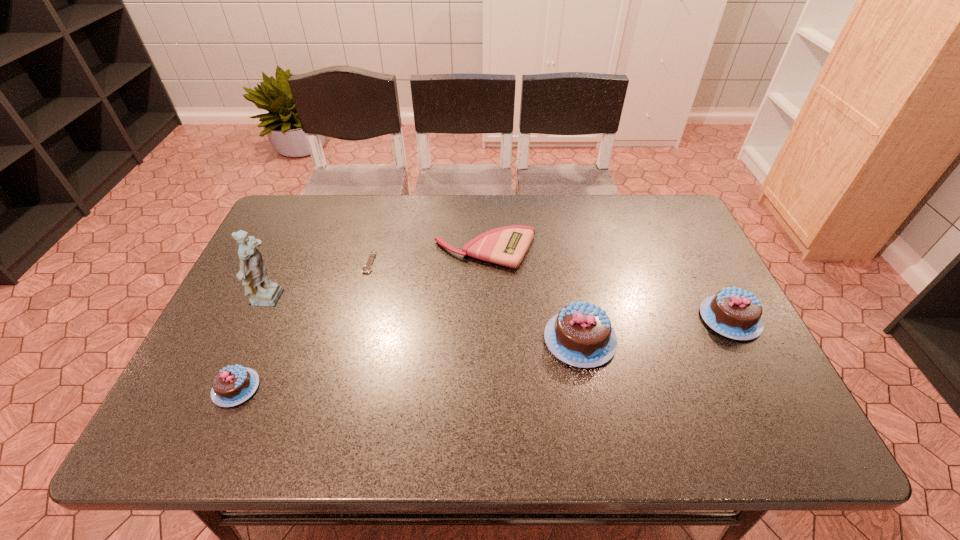
Please determine a free point for an extra chocolate_cake to ensure balance. Please provide its 2D coordinates. Your answer should be formatted as a tuple, i.e. [(x, y)], where the tuple contains the x and y coordinates of a point satisfying the conditions above.

[(416, 362)]